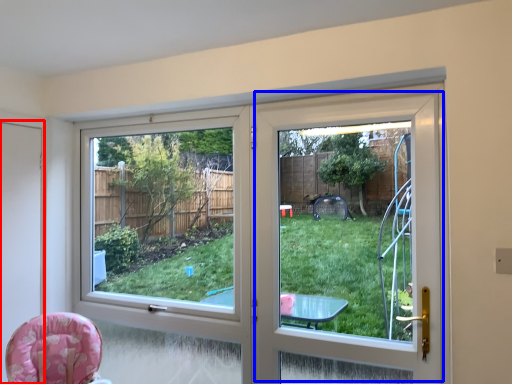
Question: Which of the following is the farthest to the observer, screen door (highlighted by a red box) or screen door (highlighted by a blue box)?

Choices:
 (A) screen door
 (B) screen door

Answer: (A)